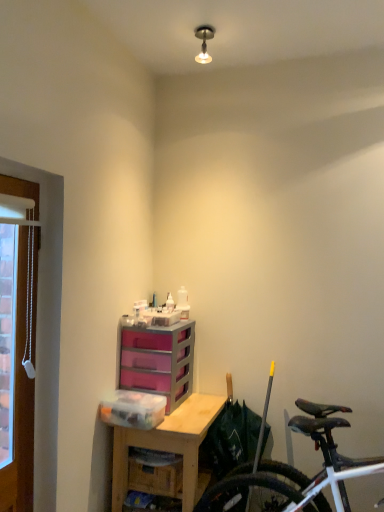
At what (x,y) coordinates should I click in order to perform the action: click on clear plastic container at lower center. Please return your answer as a coordinate pair (x, y). This screenshot has height=512, width=384. Looking at the image, I should click on (133, 409).

In order to face clear plastic container at lower center, should I rotate leftwards or rightwards?

To align with it, rotate left about 7.707°.

Where is `wooden desk at center`? wooden desk at center is located at coordinates (168, 444).

The image size is (384, 512). Describe the element at coordinates (16, 344) in the screenshot. I see `brown wooden door at left` at that location.

In order to click on pink plastic chest of drawers at center in this screenshot , I will do `click(159, 361)`.

The height and width of the screenshot is (512, 384). Find the location of `clear plastic container at lower center`. clear plastic container at lower center is located at coordinates (133, 409).

In the scene shown: Is white matte bicycle at lower right completely or partially outside of metallic ceiling light at upper center?

white matte bicycle at lower right is positioned outside metallic ceiling light at upper center.

You are a GUI agent. You are given a task and a screenshot of the screen. Output one action in this format:
    pyautogui.click(x=<x>, y=<y>)
    Task: Click on the lamp to the left of white matte bicycle at lower right
    
    Given the screenshot: What is the action you would take?
    pyautogui.click(x=204, y=42)

Is white matte bicycle at lower right far away from metallic ceiling light at upper center?

Indeed, white matte bicycle at lower right is not near metallic ceiling light at upper center.

Is metallic ceiling light at upper center further to camera compared to white matte bicycle at lower right?

Yes, metallic ceiling light at upper center is further from the camera.

From the image's perspective, does metallic ceiling light at upper center appear lower than white matte bicycle at lower right?

No.

Consider the image. Which is correct: metallic ceiling light at upper center is inside white matte bicycle at lower right, or outside of it?

The correct answer is: outside.

Considering the sizes of metallic ceiling light at upper center and white matte bicycle at lower right in the image, is metallic ceiling light at upper center taller or shorter than white matte bicycle at lower right?

Considering their sizes, metallic ceiling light at upper center has less height than white matte bicycle at lower right.

Considering the positions of objects wooden desk at center and brown wooden door at left in the image provided, who is behind, wooden desk at center or brown wooden door at left?

wooden desk at center is more distant.

Which of these two, wooden desk at center or brown wooden door at left, stands taller?

brown wooden door at left is taller.

From a real-world perspective, does wooden desk at center stand above brown wooden door at left?

Actually, wooden desk at center is physically below brown wooden door at left in the real world.

Choose the correct answer: Is wooden desk at center inside brown wooden door at left or outside it?

wooden desk at center is spatially situated outside brown wooden door at left.

What's the angular difference between clear plastic container at lower center and white matte bicycle at lower right's facing directions?

There is a 0.509-degree angle between the facing directions of clear plastic container at lower center and white matte bicycle at lower right.

Who is smaller, clear plastic container at lower center or white matte bicycle at lower right?

clear plastic container at lower center is smaller.

From a real-world perspective, which object rests below the other?

white matte bicycle at lower right, from a real-world perspective.

Is clear plastic container at lower center far away from white matte bicycle at lower right?

No, clear plastic container at lower center is not far away from white matte bicycle at lower right.

From the image's perspective, is metallic ceiling light at upper center positioned above or below pink plastic chest of drawers at center?

metallic ceiling light at upper center is situated higher than pink plastic chest of drawers at center in the image.

Which point is more forward, (205, 37) or (168, 414)?

The point (205, 37) is more forward.

Is metallic ceiling light at upper center positioned beyond the bounds of pink plastic chest of drawers at center?

Absolutely, metallic ceiling light at upper center is external to pink plastic chest of drawers at center.

Which of these two, metallic ceiling light at upper center or pink plastic chest of drawers at center, is thinner?

metallic ceiling light at upper center.

From a real-world perspective, does pink plastic chest of drawers at center sit lower than white matte bicycle at lower right?

No.

Based on their sizes in the image, would you say pink plastic chest of drawers at center is bigger or smaller than white matte bicycle at lower right?

In the image, pink plastic chest of drawers at center appears to be smaller than white matte bicycle at lower right.

Is pink plastic chest of drawers at center turned away from white matte bicycle at lower right?

Result: That's not correct — pink plastic chest of drawers at center is not looking away from white matte bicycle at lower right.

Are pink plastic chest of drawers at center and white matte bicycle at lower right far apart?

No, pink plastic chest of drawers at center is not far away from white matte bicycle at lower right.

From a real-world perspective, is clear plastic container at lower center physically located above or below brown wooden door at left?

clear plastic container at lower center is situated lower than brown wooden door at left in the real world.

Would you say clear plastic container at lower center is a long distance from brown wooden door at left?

That's not correct — clear plastic container at lower center is a little close to brown wooden door at left.

Considering the positions of objects clear plastic container at lower center and brown wooden door at left in the image provided, who is in front, clear plastic container at lower center or brown wooden door at left?

brown wooden door at left is closer to the camera.

Locate an element on the screen. The width and height of the screenshot is (384, 512). bicycle in front of the metallic ceiling light at upper center is located at coordinates (297, 470).

The height and width of the screenshot is (512, 384). I want to click on bicycle located on the right of metallic ceiling light at upper center, so click(297, 470).

When comparing their distances from white matte bicycle at lower right, does clear plastic container at lower center or wooden desk at center seem closer?

Among the two, wooden desk at center is located nearer to white matte bicycle at lower right.

Based on their spatial positions, is white matte bicycle at lower right or pink plastic chest of drawers at center further from clear plastic container at lower center?

white matte bicycle at lower right is further to clear plastic container at lower center.

Considering their positions, is clear plastic container at lower center positioned closer to brown wooden door at left than metallic ceiling light at upper center?

The object closer to brown wooden door at left is clear plastic container at lower center.

Considering their positions, is clear plastic container at lower center positioned closer to pink plastic chest of drawers at center than metallic ceiling light at upper center?

The object closer to pink plastic chest of drawers at center is clear plastic container at lower center.

Which object lies nearer to the anchor point brown wooden door at left, white matte bicycle at lower right or pink plastic chest of drawers at center?

Based on the image, pink plastic chest of drawers at center appears to be nearer to brown wooden door at left.

From the image, which object appears to be farther from white matte bicycle at lower right, metallic ceiling light at upper center or wooden desk at center?

The object further to white matte bicycle at lower right is metallic ceiling light at upper center.

Considering their positions, is brown wooden door at left positioned closer to pink plastic chest of drawers at center than clear plastic container at lower center?

The object closer to pink plastic chest of drawers at center is clear plastic container at lower center.

Based on their spatial positions, is pink plastic chest of drawers at center or clear plastic container at lower center further from brown wooden door at left?

Among the two, pink plastic chest of drawers at center is located further to brown wooden door at left.

The image size is (384, 512). I want to click on storage box between pink plastic chest of drawers at center and wooden desk at center from top to bottom, so click(x=133, y=409).

The height and width of the screenshot is (512, 384). I want to click on chest of drawers between brown wooden door at left and white matte bicycle at lower right from left to right, so click(159, 361).

Locate an element on the screen. bicycle between metallic ceiling light at upper center and wooden desk at center from top to bottom is located at coordinates (297, 470).

You are a GUI agent. You are given a task and a screenshot of the screen. Output one action in this format:
    pyautogui.click(x=<x>, y=<y>)
    Task: Click on the window frame between metallic ceiling light at upper center and wooden desk at center from top to bottom
    The height and width of the screenshot is (512, 384).
    Given the screenshot: What is the action you would take?
    pyautogui.click(x=16, y=344)